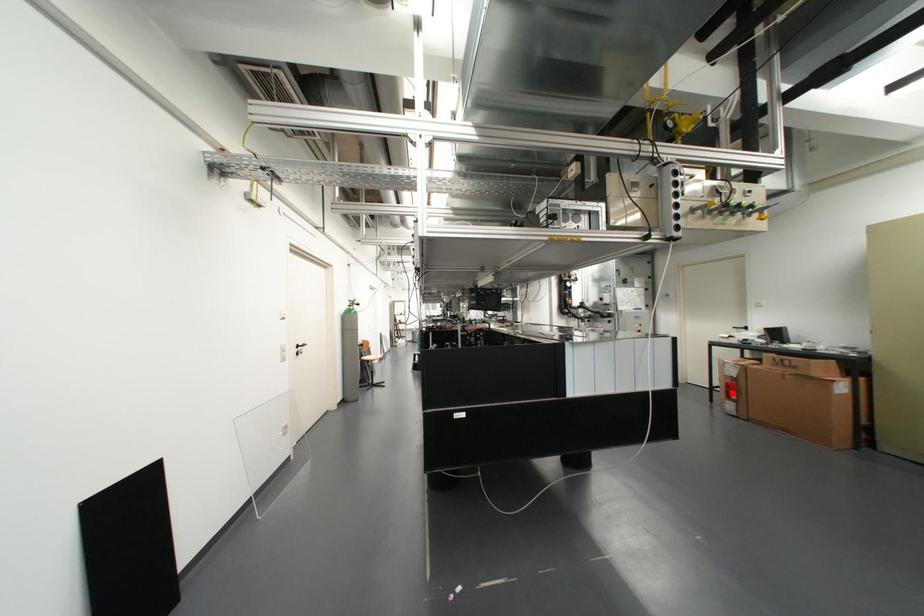
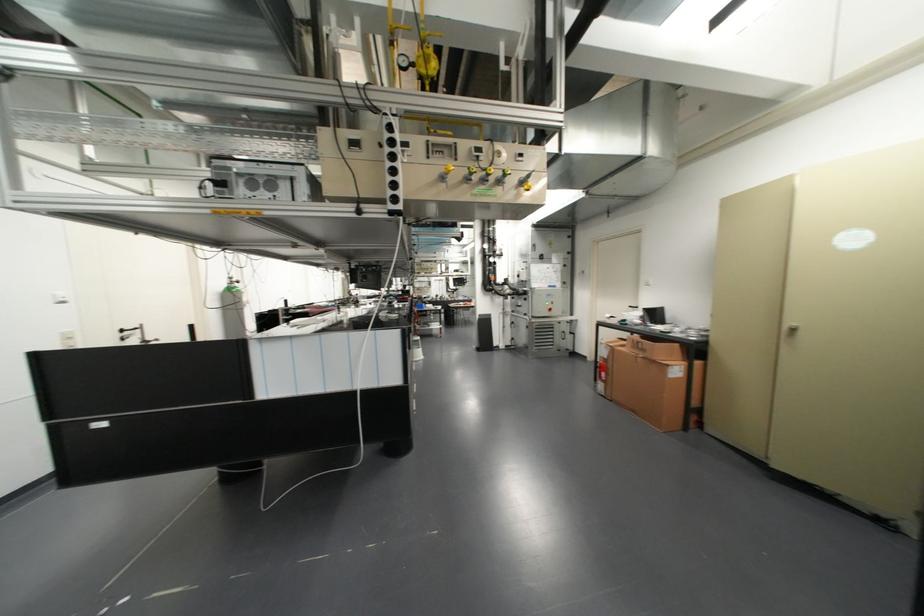
Question: I am providing you with two images of the same scene from different viewpoints. In image1, a red point is highlighted. Considering the same 3D point in image2, which of the following is correct?

Choices:
 (A) It is closer
 (B) It is farther

Answer: (A)